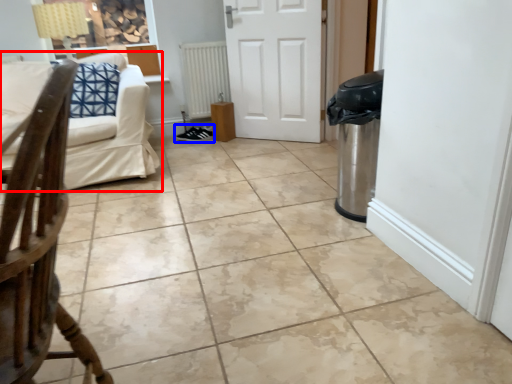
Question: Among these objects, which one is farthest to the camera, studio couch (highlighted by a red box) or footwear (highlighted by a blue box)?

Choices:
 (A) studio couch
 (B) footwear

Answer: (B)